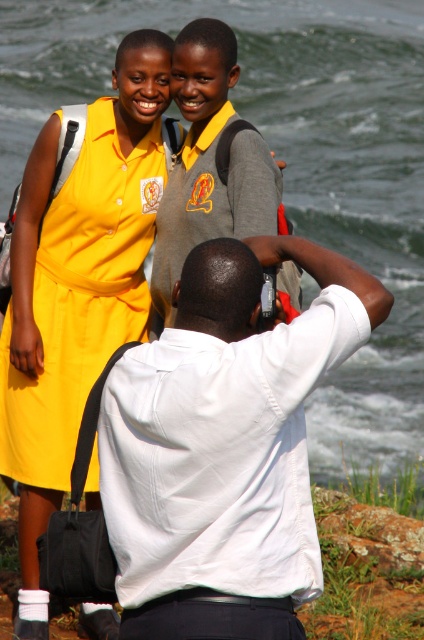
Is yellow fabric dress at upper left below gray fabric uniform at center?

Indeed, yellow fabric dress at upper left is positioned under gray fabric uniform at center.

Which of these two, yellow fabric dress at upper left or gray fabric uniform at center, stands shorter?

Standing shorter between the two is gray fabric uniform at center.

Between point (69, 392) and point (225, 163), which one is positioned in front?

Point (225, 163) is in front.

The width and height of the screenshot is (424, 640). Identify the location of yellow fabric dress at upper left. (80, 296).

Is yellow fabric dress at upper left closer to camera compared to white cotton shirt at center?

No, yellow fabric dress at upper left is further to the viewer.

Does yellow fabric dress at upper left appear under white cotton shirt at center?

No, yellow fabric dress at upper left is not below white cotton shirt at center.

Does point (105, 296) come farther from viewer compared to point (151, 532)?

Yes, it is behind point (151, 532).

Where is `yellow fabric dress at upper left`? The height and width of the screenshot is (640, 424). yellow fabric dress at upper left is located at coordinates (80, 296).

Who is more forward, (150, 579) or (183, 28)?

Positioned in front is point (150, 579).

Who is positioned more to the left, white cotton shirt at center or gray fabric uniform at center?

Positioned to the left is white cotton shirt at center.

In the scene shown: Measure the distance between white cotton shirt at center and camera.

They are 3.87 meters apart.

Identify the location of white cotton shirt at center. [x=225, y=433].